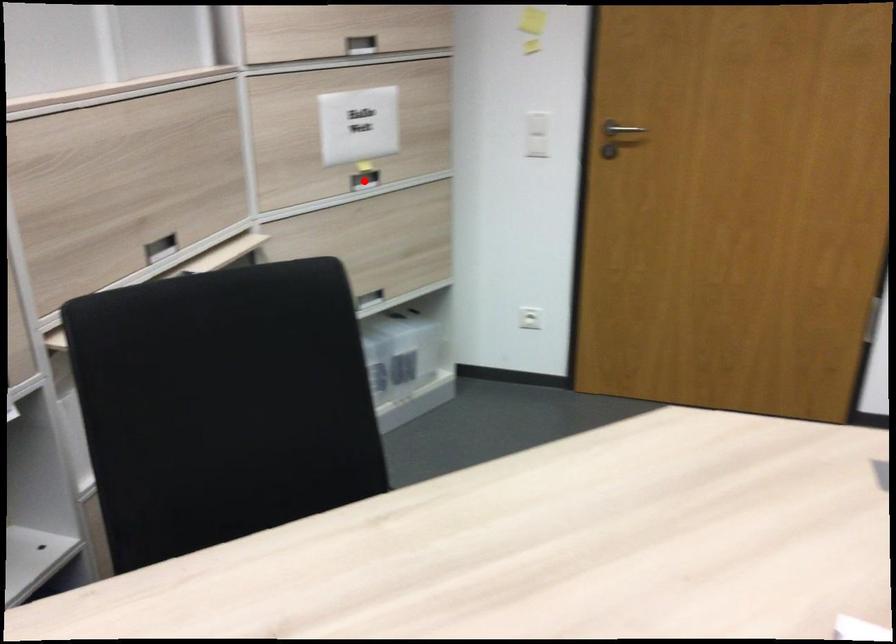
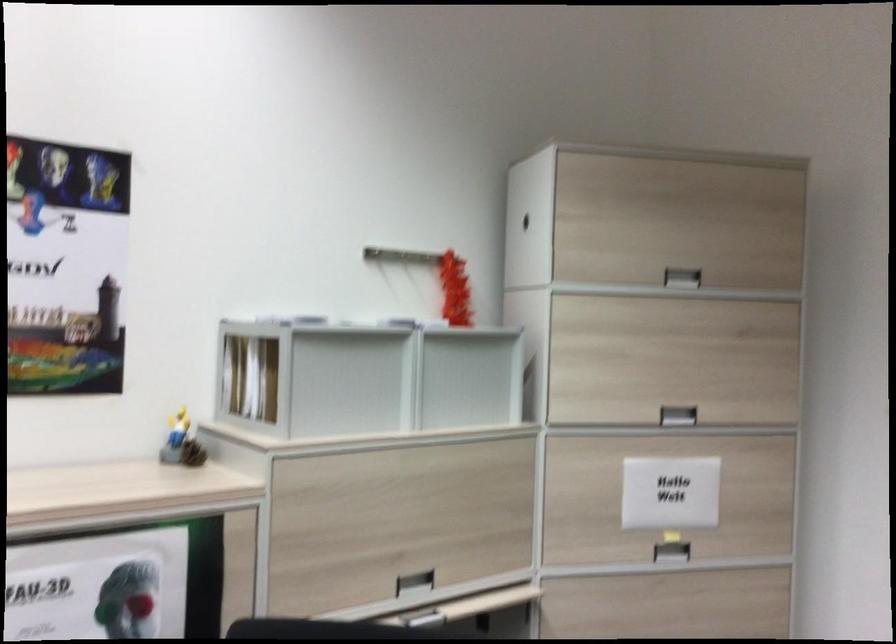
Question: I am providing you with two images of the same scene from different viewpoints. Given a red point in image1, look at the same physical point in image2. Is it:

Choices:
 (A) Closer to the viewpoint
 (B) Farther from the viewpoint

Answer: (A)